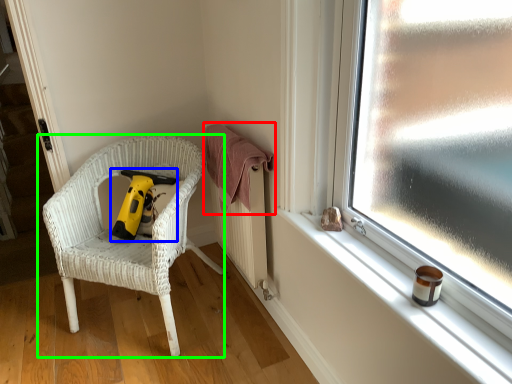
Question: Based on their relative distances, which object is nearer to clothe (highlighted by a red box)? Choose from vacuum (highlighted by a blue box) and chair (highlighted by a green box).

Choices:
 (A) vacuum
 (B) chair

Answer: (A)